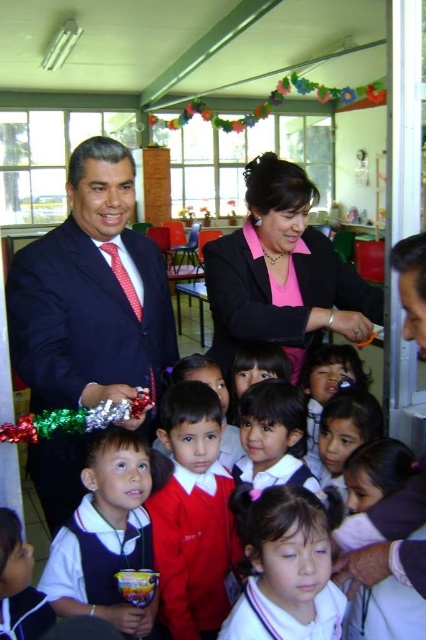
Looking at this image, is white matte uniform at center wider than white uniform at center?

Correct, the width of white matte uniform at center exceeds that of white uniform at center.

Who is taller, white matte uniform at center or white uniform at center?

Standing taller between the two is white matte uniform at center.

Is point (147, 522) closer to camera compared to point (230, 632)?

No, (147, 522) is behind (230, 632).

At what (x,y) coordinates should I click in order to perform the action: click on white matte uniform at center. Please return your answer as a coordinate pair (x, y). Looking at the image, I should click on (108, 534).

Is pink matte blazer at center wider than white uniform at center?

Indeed, pink matte blazer at center has a greater width compared to white uniform at center.

Which of these two, pink matte blazer at center or white uniform at center, stands shorter?

white uniform at center is shorter.

Find the location of `pink matte blazer at center`. pink matte blazer at center is located at coordinates (282, 273).

You are a GUI agent. You are given a task and a screenshot of the screen. Output one action in this format:
    pyautogui.click(x=<x>, y=<y>)
    Task: Click on the pink matte blazer at center
    The height and width of the screenshot is (640, 426).
    Given the screenshot: What is the action you would take?
    pyautogui.click(x=282, y=273)

Between point (175, 541) and point (54, 618), which one is positioned in front?

Point (54, 618) is in front.

Looking at this image, who is more distant from viewer, (172, 577) or (14, 524)?

Positioned behind is point (172, 577).

Does point (207, 486) lie in front of point (17, 630)?

No, it is behind (17, 630).

At what (x,y) coordinates should I click in order to perform the action: click on red smooth shirt at center. Please return your answer as a coordinate pair (x, y). This screenshot has width=426, height=640. Looking at the image, I should click on (192, 515).